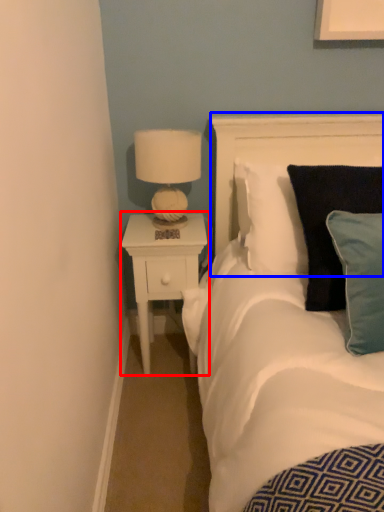
Question: Which object appears closest to the camera in this image, nightstand (highlighted by a red box) or headboard (highlighted by a blue box)?

Choices:
 (A) nightstand
 (B) headboard

Answer: (B)